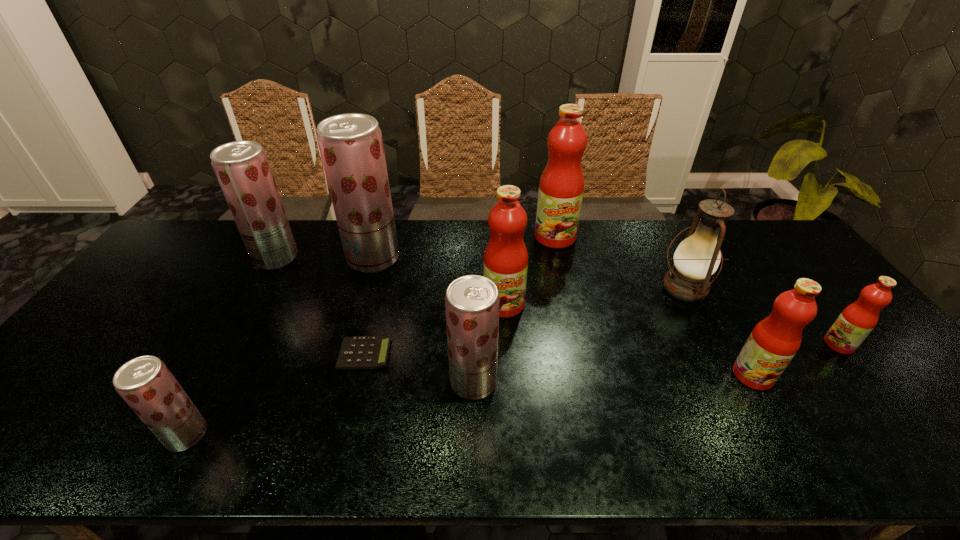
The height and width of the screenshot is (540, 960). I want to click on fruit juice identified as the sixth closest to the sixth fruit juice from right to left, so click(x=774, y=341).

Locate an element on the screen. fruit juice object that ranks as the second closest to the second farthest pink fruit juice is located at coordinates (561, 187).

Locate which strawberry fruit juice ranks in proximity to the second nearest strawberry fruit juice. Please provide its 2D coordinates. Your answer should be formatted as a tuple, i.e. [(x, y)], where the tuple contains the x and y coordinates of a point satisfying the conditions above.

[(351, 146)]

In order to click on strawberry fruit juice that is the nearest to the rightmost pink fruit juice in this screenshot , I will do `click(472, 302)`.

This screenshot has width=960, height=540. In order to click on pink fruit juice that is the nearest to the oil lamp in this screenshot , I will do `click(774, 341)`.

Identify the location of pink fruit juice that stands as the closest to the smallest strawberry fruit juice. (506, 258).

What are the coordinates of `vacant area that satisfies the following two spatial constraints: 1. on the front side of the second strawberry fruit juice from right to left; 2. on the left side of the shortest object` in the screenshot? It's located at (346, 354).